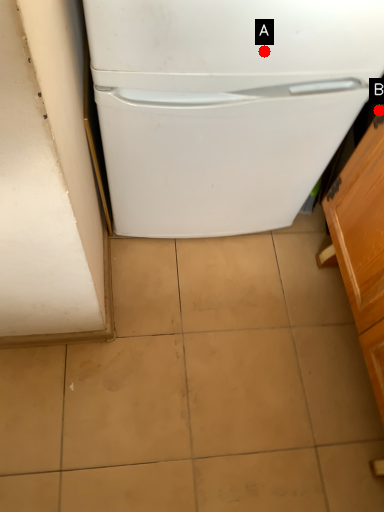
Question: Two points are circled on the image, labeled by A and B beside each circle. Among these points, which one is farthest from the camera?

Choices:
 (A) A is further
 (B) B is further

Answer: (B)